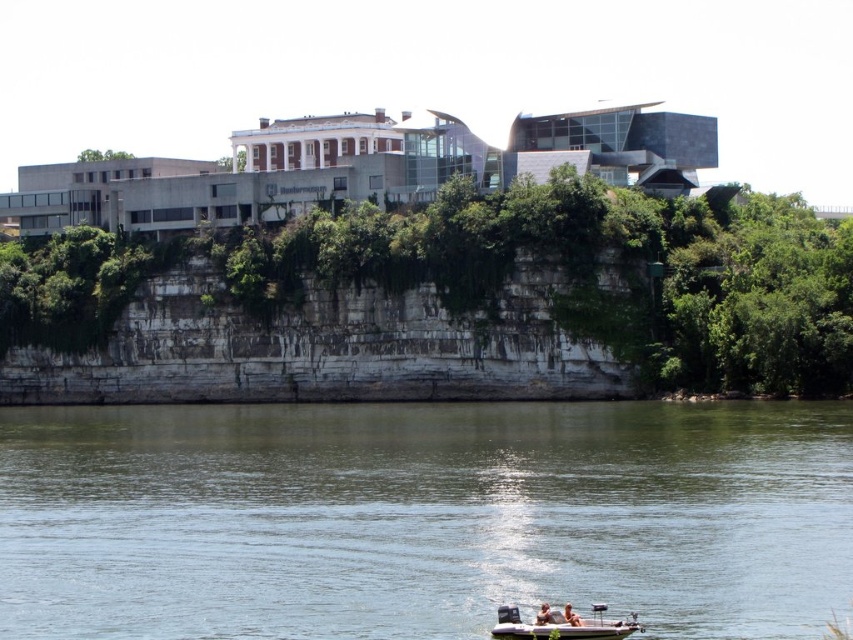
Question: Does greenish water at lower center have a smaller size compared to white plastic boat at lower center?

Choices:
 (A) no
 (B) yes

Answer: (A)

Question: Which of the following is the farthest from the observer?

Choices:
 (A) (563, 621)
 (B) (567, 620)

Answer: (A)

Question: Considering the relative positions of greenish water at lower center and white plastic boat at lower center in the image provided, where is greenish water at lower center located with respect to white plastic boat at lower center?

Choices:
 (A) below
 (B) above

Answer: (B)

Question: Which object is closer to the camera taking this photo?

Choices:
 (A) greenish water at lower center
 (B) light brown wooden boat at lower center

Answer: (A)

Question: Is greenish water at lower center positioned at the back of white plastic boat at lower center?

Choices:
 (A) no
 (B) yes

Answer: (A)

Question: Estimate the real-world distances between objects in this image. Which object is closer to the greenish water at lower center?

Choices:
 (A) light brown wooden boat at lower center
 (B) white plastic boat at lower center

Answer: (B)